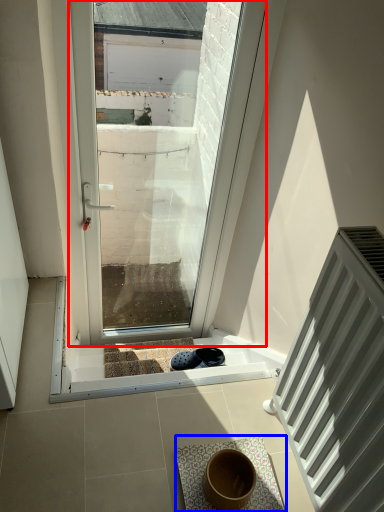
Question: Which point is further to the camera, window (highlighted by a red box) or bath mat (highlighted by a blue box)?

Choices:
 (A) window
 (B) bath mat

Answer: (A)